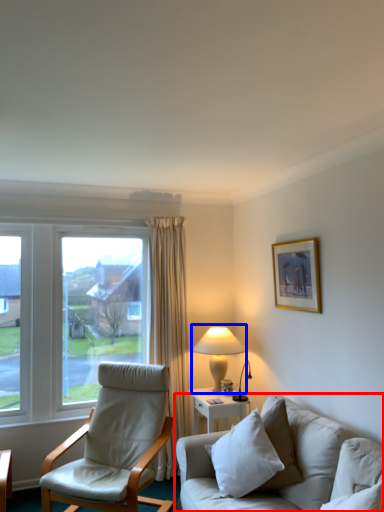
Question: Among these objects, which one is farthest to the camera, studio couch (highlighted by a red box) or table lamp (highlighted by a blue box)?

Choices:
 (A) studio couch
 (B) table lamp

Answer: (B)